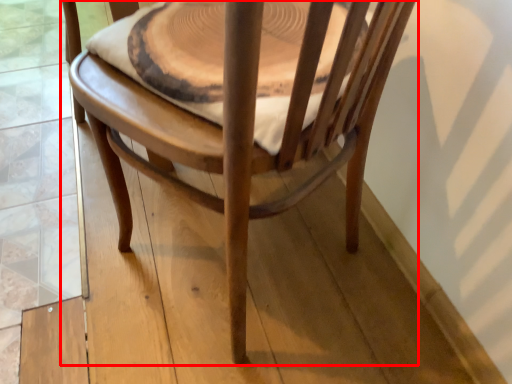
Question: From the image's perspective, considering the relative positions of chair (annotated by the red box) and round table in the image provided, where is chair (annotated by the red box) located with respect to the staircase?

Choices:
 (A) above
 (B) below

Answer: (B)